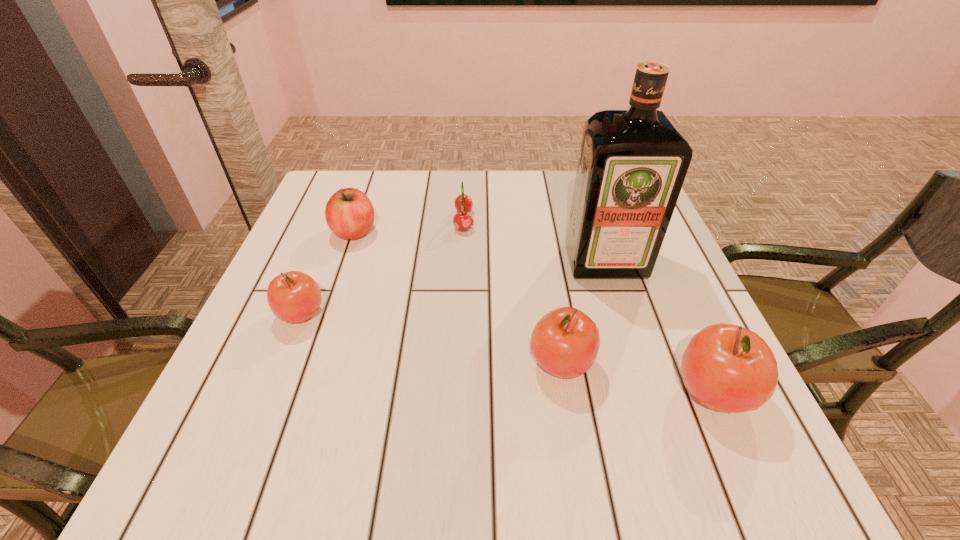
You are a GUI agent. You are given a task and a screenshot of the screen. Output one action in this format:
    pyautogui.click(x=<x>, y=<y>)
    Task: Click on the third nearest apple
    The image size is (960, 540).
    Given the screenshot: What is the action you would take?
    pyautogui.click(x=294, y=296)

In order to click on the fourth shortest object in this screenshot , I will do `click(565, 342)`.

Locate an element on the screen. The image size is (960, 540). the third apple from left to right is located at coordinates (565, 342).

Where is `the rightmost apple`? The width and height of the screenshot is (960, 540). the rightmost apple is located at coordinates (728, 368).

Locate an element on the screen. The width and height of the screenshot is (960, 540). liquor is located at coordinates (632, 164).

Where is `the farthest apple`? the farthest apple is located at coordinates (349, 213).

This screenshot has width=960, height=540. I want to click on cherry, so click(x=462, y=220).

The height and width of the screenshot is (540, 960). What are the coordinates of `vacant region located on the right of the third nearest object` in the screenshot? It's located at (392, 314).

The height and width of the screenshot is (540, 960). Find the location of `vacant area situated 0.200m on the left of the fourth shortest object`. vacant area situated 0.200m on the left of the fourth shortest object is located at coordinates (417, 363).

Find the location of a particular element. vacant space situated 0.390m on the left of the rightmost apple is located at coordinates (444, 393).